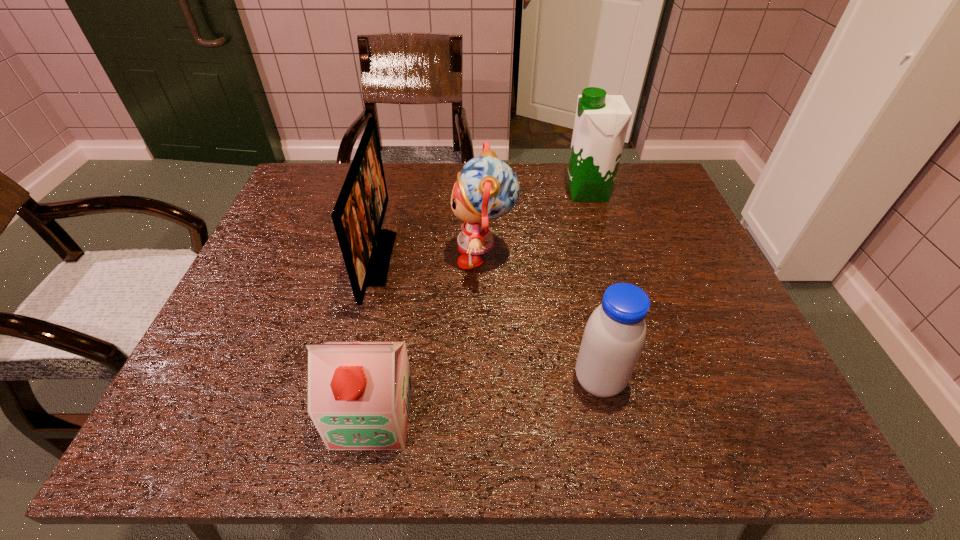
This screenshot has height=540, width=960. I want to click on the farthest object, so click(601, 122).

You are a GUI agent. You are given a task and a screenshot of the screen. Output one action in this format:
    pyautogui.click(x=<x>, y=<y>)
    Task: Click on the tallest soya milk
    
    Given the screenshot: What is the action you would take?
    pyautogui.click(x=601, y=122)

Locate an element on the screen. The height and width of the screenshot is (540, 960). monitor is located at coordinates (358, 215).

Locate an element on the screen. doll is located at coordinates (487, 188).

The height and width of the screenshot is (540, 960). Find the location of `the leftmost soya milk`. the leftmost soya milk is located at coordinates (359, 393).

Locate an element on the screen. vacant area situated 0.230m on the front-facing side of the farthest object is located at coordinates (487, 192).

This screenshot has height=540, width=960. What are the coordinates of `blank space located 0.350m on the front-facing side of the farthest object` in the screenshot? It's located at (445, 192).

Identify the location of vacant space located on the front-facing side of the farthest object. This screenshot has height=540, width=960. (496, 192).

At what (x,y) coordinates should I click in order to perform the action: click on vacant area situated 0.380m on the front-facing side of the monitor. Please return your answer as a coordinate pair (x, y). Looking at the image, I should click on (545, 258).

At what (x,y) coordinates should I click in order to perform the action: click on vacant space positioned on the face of the third object from right to left. Please return your answer as a coordinate pair (x, y). Looking at the image, I should click on (325, 256).